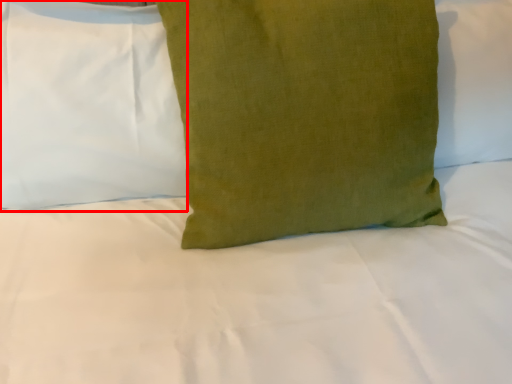
Question: Considering the relative positions of pillow (annotated by the red box) and pillow in the image provided, where is pillow (annotated by the red box) located with respect to the staircase?

Choices:
 (A) right
 (B) left

Answer: (B)